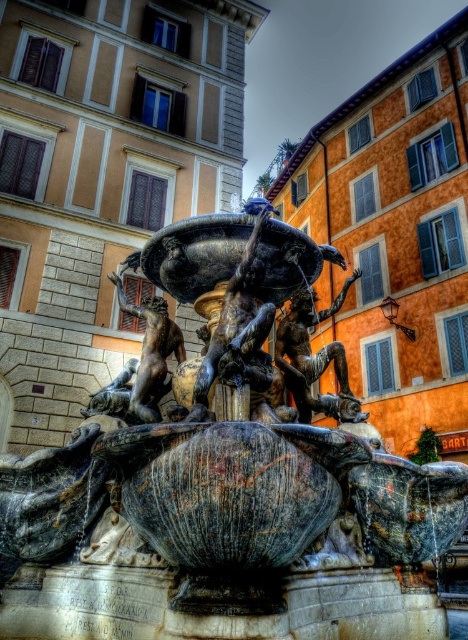
Is polished bronze statue at center wider than bronze statue at center?

No, polished bronze statue at center is not wider than bronze statue at center.

How far apart are polished bronze statue at center and bronze statue at center?

polished bronze statue at center is 6.83 meters away from bronze statue at center.

Locate an element on the screen. Image resolution: width=468 pixels, height=640 pixels. polished bronze statue at center is located at coordinates (314, 356).

Can you confirm if marble statue at center is positioned above bronze statue at center?

No.

Is marble statue at center taller than bronze statue at center?

Yes.

Between point (236, 449) and point (152, 348), which one is positioned in front?

Point (236, 449) is more forward.

Where is `marble statue at center`? This screenshot has width=468, height=640. marble statue at center is located at coordinates (222, 480).

Who is positioned more to the right, marble statue at center or polished bronze statue at center?

polished bronze statue at center is more to the right.

Between point (204, 419) and point (314, 314), which one is positioned behind?

Point (314, 314)

Looking at this image, who is more distant from viewer, (112, 532) or (343, 285)?

The point (343, 285) is more distant.

Where is `marble statue at center`? marble statue at center is located at coordinates (222, 480).